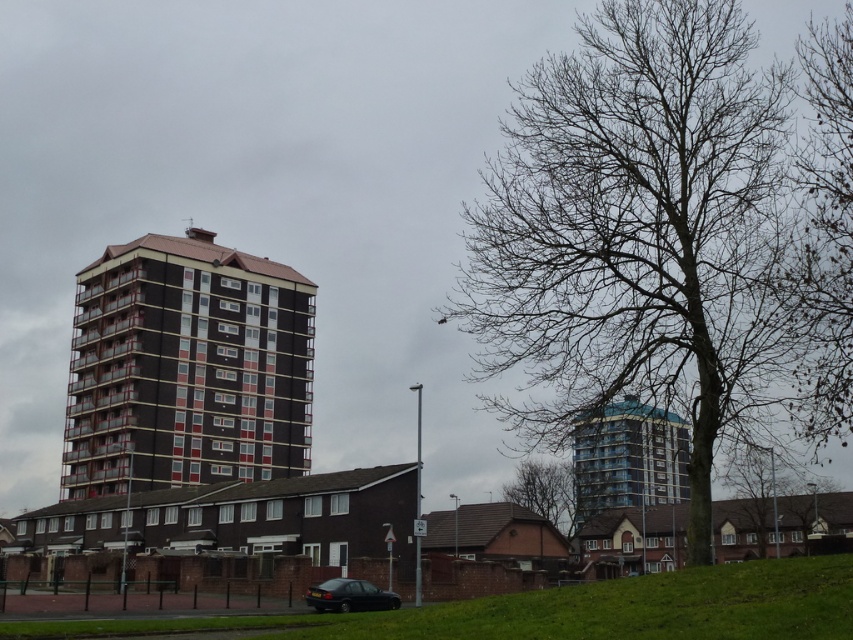
You are a delivery person trying to park your matte black sedan at lower center near the blue glass building at center. Given their sizes, will your car fit in the space between them?

The blue glass building at center is larger in size than the matte black sedan at lower center, so there should be sufficient space for the matte black sedan at lower center to park near the blue glass building at center.

You are a delivery drone that needs to fly between the brown glossy building at center and the blue glass building at center. Which building should you avoid flying too close to if you want to maintain stability, based on their widths?

The blue glass building at center is wider than the brown glossy building at center, so you should avoid flying too close to the blue glass building at center to maintain stability.

Based on the photo, you are standing in the urban landscape and want to walk from the green grass at lower center to the bare wood tree at center. Which direction should you move to get closer to the tree?

You should move forward because the bare wood tree at center is closer to you than the green grass at lower center, so moving toward it would bring you closer.